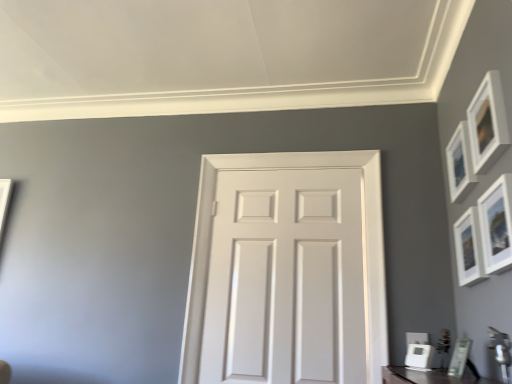
Question: Does white glossy picture frame at lower right, the sixth picture frame viewed from the top, have a lesser height compared to matte white picture frame at lower right, which ranks as the second picture frame in bottom-to-top order?

Choices:
 (A) no
 (B) yes

Answer: (B)

Question: From the image's perspective, does white glossy picture frame at lower right, the sixth picture frame viewed from the top, appear higher than matte white picture frame at lower right, which ranks as the second picture frame in bottom-to-top order?

Choices:
 (A) yes
 (B) no

Answer: (B)

Question: Is white glossy picture frame at lower right, which is counted as the 1th picture frame, starting from the bottom, positioned with its back to matte white picture frame at lower right, which ranks as the second picture frame in bottom-to-top order?

Choices:
 (A) yes
 (B) no

Answer: (B)

Question: From the image's perspective, is white glossy picture frame at lower right, which is counted as the 1th picture frame, starting from the bottom, beneath matte white picture frame at lower right, which ranks as the fifth picture frame in top-to-bottom order?

Choices:
 (A) yes
 (B) no

Answer: (A)

Question: Can you confirm if white glossy picture frame at lower right, which is counted as the 1th picture frame, starting from the bottom, is smaller than matte white picture frame at lower right, which ranks as the second picture frame in bottom-to-top order?

Choices:
 (A) no
 (B) yes

Answer: (B)

Question: Is point (476, 253) positioned closer to the camera than point (450, 195)?

Choices:
 (A) closer
 (B) farther

Answer: (A)

Question: Considering the positions of white matte picture frame at upper right, the fourth picture frame positioned from the top, and matte white picture frame at upper right, which is counted as the second picture frame, starting from the top, in the image, is white matte picture frame at upper right, the fourth picture frame positioned from the top, wider or thinner than matte white picture frame at upper right, which is counted as the second picture frame, starting from the top,?

Choices:
 (A) thin
 (B) wide

Answer: (B)

Question: Is white matte picture frame at upper right, which is the third picture frame from bottom to top, taller or shorter than matte white picture frame at upper right, which is counted as the 5th picture frame, starting from the bottom?

Choices:
 (A) short
 (B) tall

Answer: (B)

Question: Is white matte picture frame at upper right, the fourth picture frame positioned from the top, in front of or behind matte white picture frame at upper right, which is counted as the second picture frame, starting from the top, in the image?

Choices:
 (A) front
 (B) behind

Answer: (A)

Question: Is point (464, 362) positioned closer to the camera than point (477, 120)?

Choices:
 (A) farther
 (B) closer

Answer: (A)

Question: Is matte white picture frame at lower right, which ranks as the second picture frame in bottom-to-top order, taller or shorter than matte white picture frame at upper right, arranged as the sixth picture frame when ordered from the bottom?

Choices:
 (A) short
 (B) tall

Answer: (A)

Question: In the image, is matte white picture frame at lower right, which ranks as the fifth picture frame in top-to-bottom order, on the left side or the right side of matte white picture frame at upper right, arranged as the sixth picture frame when ordered from the bottom?

Choices:
 (A) left
 (B) right

Answer: (A)

Question: Is matte white picture frame at lower right, which ranks as the fifth picture frame in top-to-bottom order, spatially inside matte white picture frame at upper right, the first picture frame when ordered from top to bottom, or outside of it?

Choices:
 (A) inside
 (B) outside

Answer: (B)

Question: In the image, is white glossy picture frame at lower right, which is counted as the 1th picture frame, starting from the bottom, on the left side or the right side of matte white picture frame at lower right, which ranks as the second picture frame in bottom-to-top order?

Choices:
 (A) left
 (B) right

Answer: (A)

Question: Is white glossy picture frame at lower right, the sixth picture frame viewed from the top, in front of or behind matte white picture frame at lower right, which ranks as the fifth picture frame in top-to-bottom order, in the image?

Choices:
 (A) behind
 (B) front

Answer: (A)